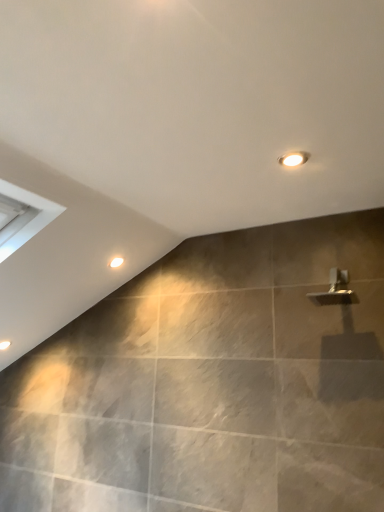
Measure the distance between matte white light fixture at upper center and camera.

A distance of 1.25 meters exists between matte white light fixture at upper center and camera.

In order to click on matte white light fixture at upper center in this screenshot , I will do `click(294, 159)`.

The image size is (384, 512). Describe the element at coordinates (294, 159) in the screenshot. I see `matte white light fixture at upper center` at that location.

Describe the element at coordinates (116, 262) in the screenshot. I see `white glossy droplight at upper center` at that location.

The width and height of the screenshot is (384, 512). In order to click on white glossy droplight at upper center in this screenshot , I will do `click(116, 262)`.

This screenshot has height=512, width=384. I want to click on matte white light fixture at upper center, so click(x=294, y=159).

Can you confirm if white glossy droplight at upper center is positioned to the left of matte white light fixture at upper center?

Yes, white glossy droplight at upper center is to the left of matte white light fixture at upper center.

Between white glossy droplight at upper center and matte white light fixture at upper center, which one is positioned in front?

matte white light fixture at upper center.

Does point (123, 260) come behind point (289, 164)?

Yes, point (123, 260) is farther from viewer.

From the image's perspective, which is below, white glossy droplight at upper center or matte white light fixture at upper center?

white glossy droplight at upper center is shown below in the image.

From a real-world perspective, is white glossy droplight at upper center physically located above or below matte white light fixture at upper center?

In terms of real-world spatial position, white glossy droplight at upper center is below matte white light fixture at upper center.

Which object is wider, white glossy droplight at upper center or matte white light fixture at upper center?

Wider between the two is matte white light fixture at upper center.

Does white glossy droplight at upper center have a greater height compared to matte white light fixture at upper center?

Indeed, white glossy droplight at upper center has a greater height compared to matte white light fixture at upper center.

Considering the sizes of objects white glossy droplight at upper center and matte white light fixture at upper center in the image provided, who is bigger, white glossy droplight at upper center or matte white light fixture at upper center?

white glossy droplight at upper center.

Is matte white light fixture at upper center inside white glossy droplight at upper center?

Actually, matte white light fixture at upper center is outside white glossy droplight at upper center.

Is white glossy droplight at upper center in contact with matte white light fixture at upper center?

white glossy droplight at upper center and matte white light fixture at upper center are not in contact.

Is white glossy droplight at upper center turned away from matte white light fixture at upper center?

No, matte white light fixture at upper center is not at the back of white glossy droplight at upper center.

What's the angular difference between white glossy droplight at upper center and matte white light fixture at upper center's facing directions?

white glossy droplight at upper center and matte white light fixture at upper center are facing 0.644 degrees away from each other.

Measure the distance from white glossy droplight at upper center to matte white light fixture at upper center.

white glossy droplight at upper center is 1.01 meters from matte white light fixture at upper center.

Identify the location of light fixture located above the white glossy droplight at upper center (from the image's perspective). The image size is (384, 512). (294, 159).

Based on the photo, would you say matte white light fixture at upper center is to the left or to the right of white glossy droplight at upper center in the picture?

In the image, matte white light fixture at upper center appears on the right side of white glossy droplight at upper center.

Which is behind, matte white light fixture at upper center or white glossy droplight at upper center?

white glossy droplight at upper center is further from the camera.

Is point (298, 157) closer or farther from the camera than point (116, 266)?

Point (298, 157) appears to be closer to the viewer than point (116, 266).

From the image's perspective, relative to white glossy droplight at upper center, is matte white light fixture at upper center above or below?

matte white light fixture at upper center is situated higher than white glossy droplight at upper center in the image.

From a real-world perspective, is matte white light fixture at upper center located beneath white glossy droplight at upper center?

No, from a real-world perspective, matte white light fixture at upper center is not below white glossy droplight at upper center.

Between matte white light fixture at upper center and white glossy droplight at upper center, which one has larger width?

matte white light fixture at upper center is wider.

Can you confirm if matte white light fixture at upper center is shorter than white glossy droplight at upper center?

Yes.

Between matte white light fixture at upper center and white glossy droplight at upper center, which one has larger size?

white glossy droplight at upper center is bigger.

Is matte white light fixture at upper center positioned beyond the bounds of white glossy droplight at upper center?

Yes.

Is matte white light fixture at upper center far from white glossy droplight at upper center?

Yes, matte white light fixture at upper center is far from white glossy droplight at upper center.

Based on the photo, is matte white light fixture at upper center facing away from white glossy droplight at upper center?

No, white glossy droplight at upper center is not at the back of matte white light fixture at upper center.

Can you tell me how much matte white light fixture at upper center and white glossy droplight at upper center differ in facing direction?

The angle between the facing direction of matte white light fixture at upper center and the facing direction of white glossy droplight at upper center is 0.644 degrees.

This screenshot has height=512, width=384. I want to click on droplight below the matte white light fixture at upper center (from a real-world perspective), so click(x=116, y=262).

Find the location of a particular element. The image size is (384, 512). droplight behind the matte white light fixture at upper center is located at coordinates (116, 262).

I want to click on light fixture on the right of the white glossy droplight at upper center, so click(x=294, y=159).